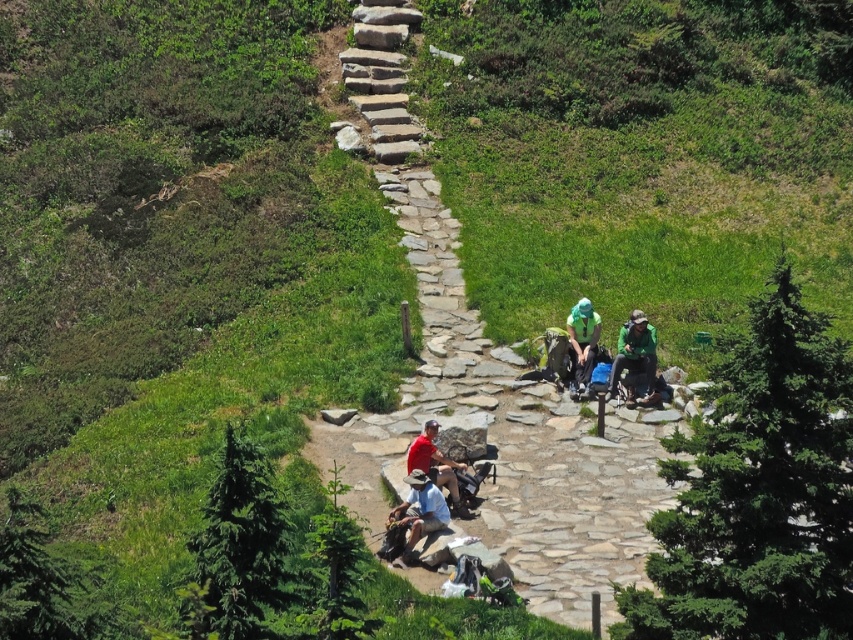
Question: Which object is closer to the camera taking this photo?

Choices:
 (A) light blue denim shorts at center
 (B) red fabric shirt at center
 (C) green textured pine at right
 (D) green fabric backpack at center-right

Answer: (C)

Question: Which point is farther to the camera?

Choices:
 (A) (276, 499)
 (B) (630, 326)
 (C) (575, 336)
 (D) (436, 467)

Answer: (C)

Question: Can you confirm if natural stone path at center is positioned above green textured pine at right?

Choices:
 (A) yes
 (B) no

Answer: (A)

Question: Among these points, which one is nearest to the camera?

Choices:
 (A) (573, 376)
 (B) (225, 541)
 (C) (412, 547)

Answer: (B)

Question: Is natural stone path at center positioned before light blue denim shorts at center?

Choices:
 (A) no
 (B) yes

Answer: (B)

Question: Observing the image, what is the correct spatial positioning of green textured pine at right in reference to light blue denim shorts at center?

Choices:
 (A) above
 (B) below

Answer: (A)